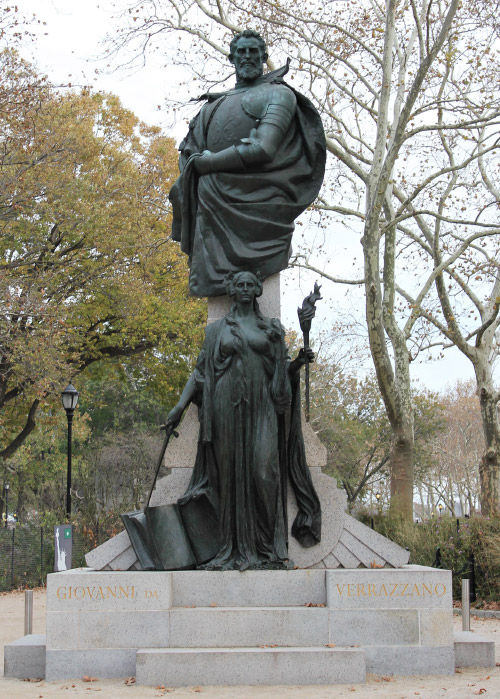
Locate an element on the screen. Image resolution: width=500 pixels, height=699 pixels. bronze statue is located at coordinates (235, 134), (239, 396).